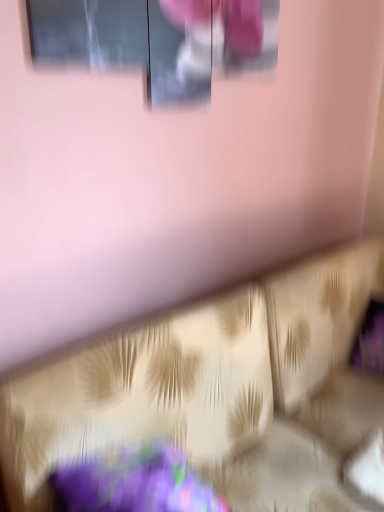
Question: Visually, is gold textured sofa at lower center positioned to the left or to the right of matte glass window at upper center?

Choices:
 (A) right
 (B) left

Answer: (A)

Question: Considering the positions of gold textured sofa at lower center and matte glass window at upper center in the image, is gold textured sofa at lower center wider or thinner than matte glass window at upper center?

Choices:
 (A) thin
 (B) wide

Answer: (B)

Question: Considering the positions of gold textured sofa at lower center and matte glass window at upper center in the image, is gold textured sofa at lower center taller or shorter than matte glass window at upper center?

Choices:
 (A) tall
 (B) short

Answer: (A)

Question: Based on their positions, is matte glass window at upper center located to the left or right of gold textured sofa at lower center?

Choices:
 (A) right
 (B) left

Answer: (B)

Question: Looking at their shapes, would you say matte glass window at upper center is wider or thinner than gold textured sofa at lower center?

Choices:
 (A) thin
 (B) wide

Answer: (A)

Question: From a real-world perspective, relative to gold textured sofa at lower center, is matte glass window at upper center vertically above or below?

Choices:
 (A) below
 (B) above

Answer: (B)

Question: From the image's perspective, is matte glass window at upper center above or below gold textured sofa at lower center?

Choices:
 (A) above
 (B) below

Answer: (A)